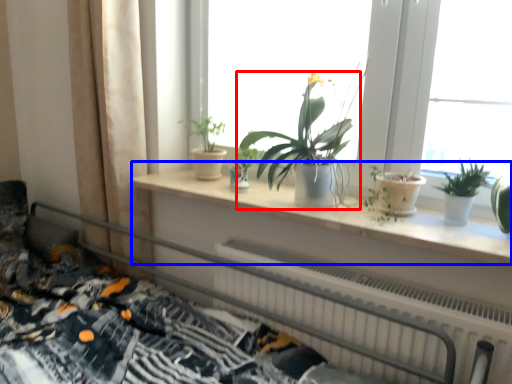
Question: Which object is further to the camera taking this photo, houseplant (highlighted by a red box) or window sill (highlighted by a blue box)?

Choices:
 (A) houseplant
 (B) window sill

Answer: (A)